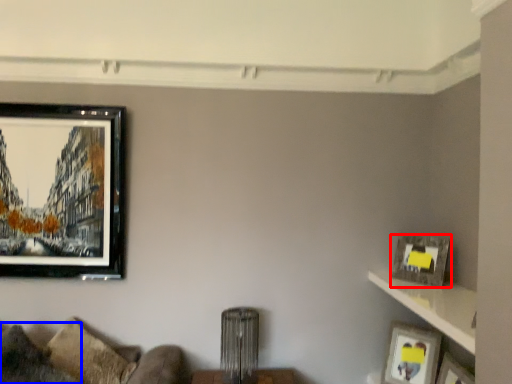
Question: Which point is further to the camera, picture frame (highlighted by a red box) or pillow (highlighted by a blue box)?

Choices:
 (A) picture frame
 (B) pillow

Answer: (A)